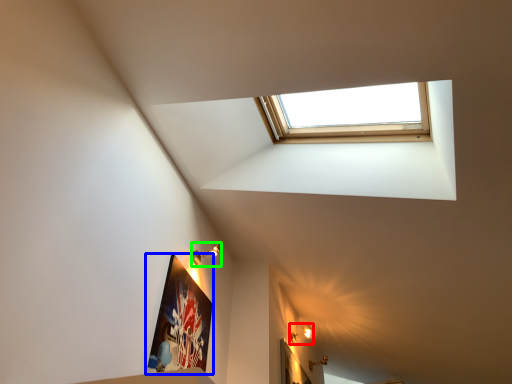
Question: Which is farther away from light fixture (highlighted by a red box)? picture frame (highlighted by a blue box) or light fixture (highlighted by a green box)?

Choices:
 (A) picture frame
 (B) light fixture

Answer: (A)